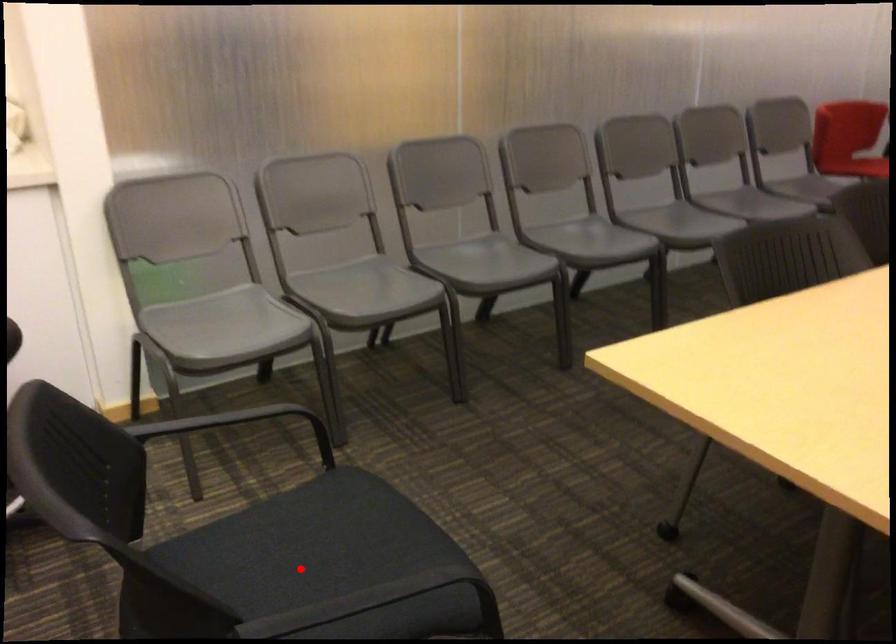
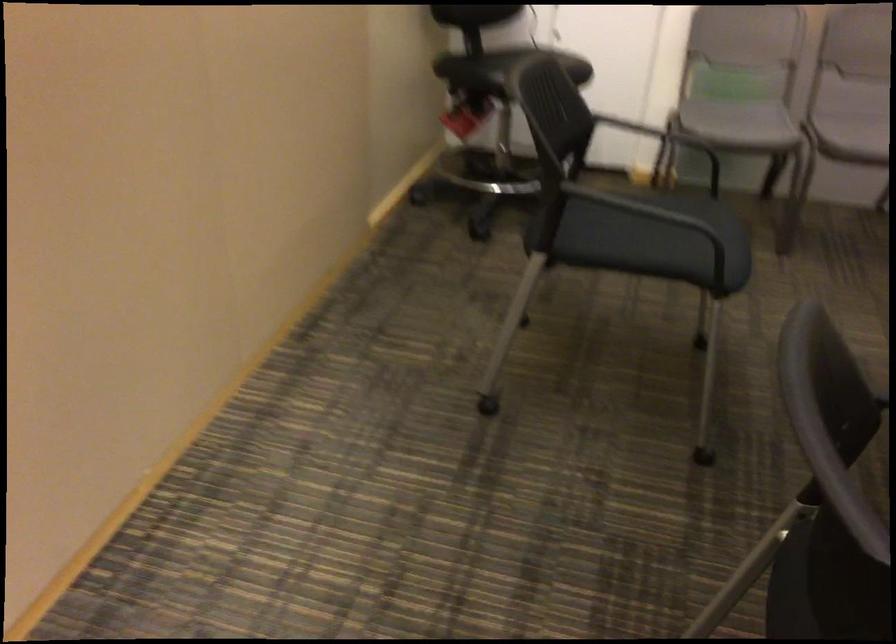
In the second image, find the point that corresponds to the highlighted location in the first image.

(657, 222)